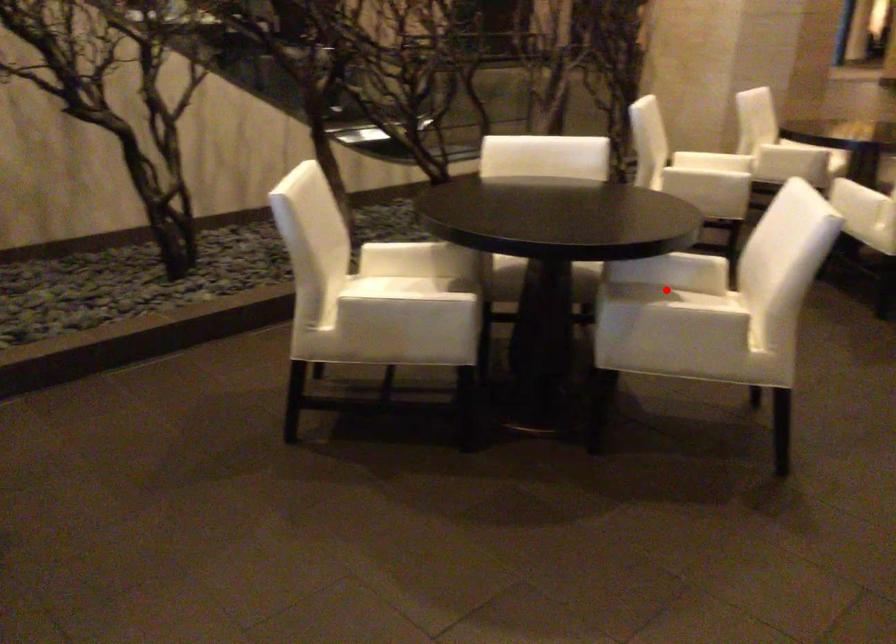
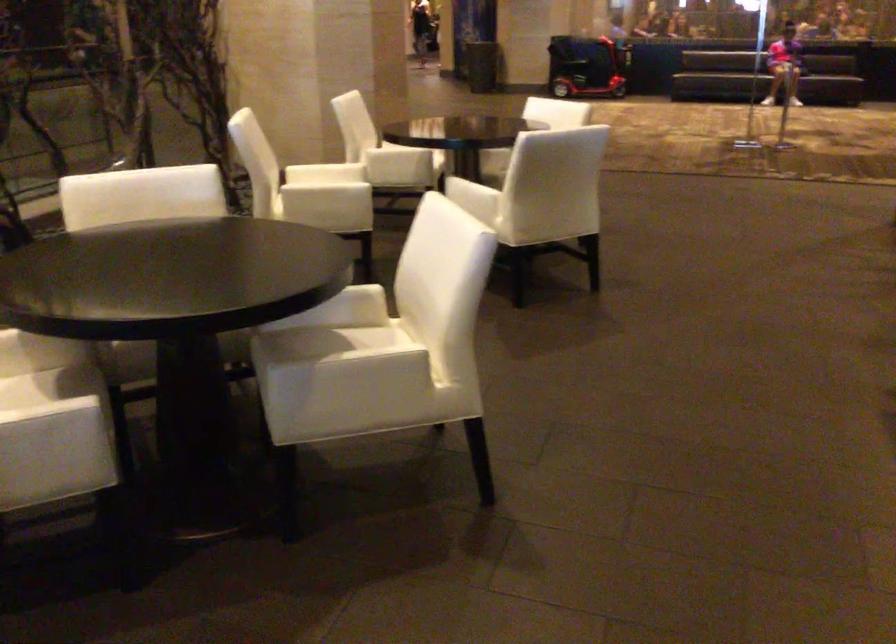
Question: I am providing you with two images of the same scene from different viewpoints. Image1 has a red point marked. In image2, the corresponding 3D location appears at what relative position? Reply with the corresponding letter.

Choices:
 (A) Closer
 (B) Farther

Answer: (A)